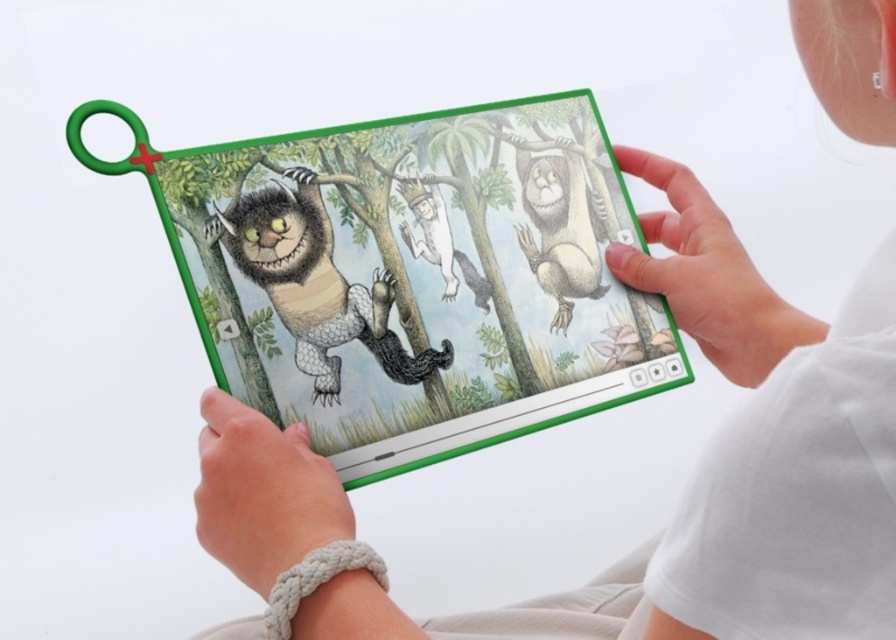
Question: Which object is closer to the camera taking this photo?

Choices:
 (A) shaggy fur cat at left
 (B) white matte hand at lower center

Answer: (B)

Question: Considering the real-world distances, which object is closest to the green plastic tablet at center?

Choices:
 (A) brown furry sloth at right
 (B) white matte hand at upper right
 (C) white matte hand at lower center

Answer: (A)

Question: Is brown furry sloth at right smaller than white paper crown at center?

Choices:
 (A) yes
 (B) no

Answer: (B)

Question: Which object is closer to the camera taking this photo?

Choices:
 (A) white matte hand at lower center
 (B) shaggy fur cat at left

Answer: (A)

Question: Does white matte hand at lower center appear under brown furry sloth at right?

Choices:
 (A) no
 (B) yes

Answer: (B)

Question: Where is white matte hand at lower center located in relation to brown furry sloth at right in the image?

Choices:
 (A) right
 (B) left

Answer: (B)